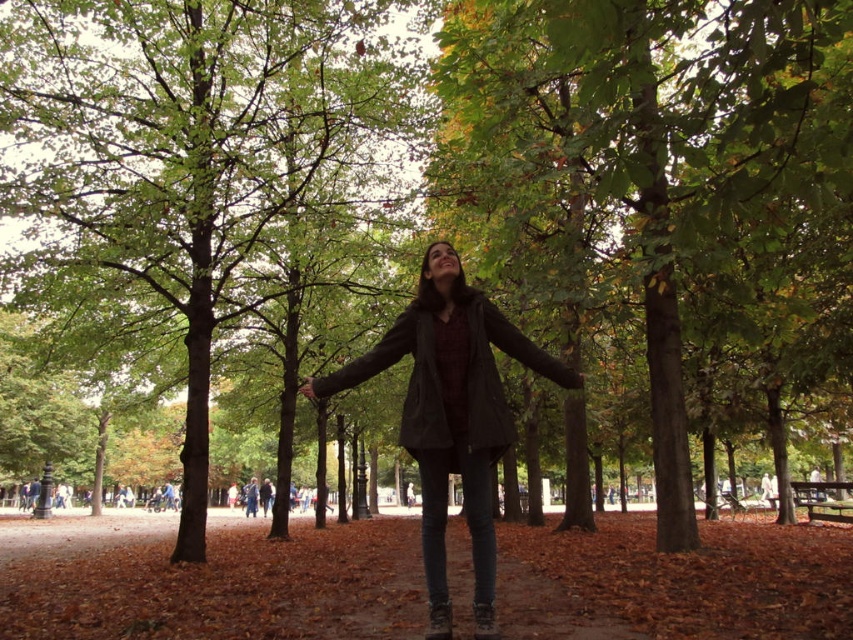
Does green leafy tree at center have a larger size compared to matte black jacket at center?

Actually, green leafy tree at center might be smaller than matte black jacket at center.

Does green leafy tree at center have a greater width compared to matte black jacket at center?

Incorrect, green leafy tree at center's width does not surpass matte black jacket at center's.

Between point (190, 477) and point (439, 378), which one is positioned behind?

The point (190, 477) is behind.

Image resolution: width=853 pixels, height=640 pixels. Find the location of `green leafy tree at center`. green leafy tree at center is located at coordinates (183, 148).

Between matte black jacket at center and dark gray matte jacket at center, which one appears on the left side from the viewer's perspective?

matte black jacket at center

Is point (490, 390) more distant than point (383, 337)?

No, (490, 390) is closer to viewer.

Image resolution: width=853 pixels, height=640 pixels. Find the location of `matte black jacket at center`. matte black jacket at center is located at coordinates (x=451, y=416).

Is point (519, 166) behind point (488, 596)?

Yes, point (519, 166) is farther from viewer.

Does green matte tree at center have a lesser width compared to matte black jacket at center?

No, green matte tree at center is not thinner than matte black jacket at center.

Measure the distance between point [590,3] and camera.

Point [590,3] is 2.94 meters away from camera.

Locate an element on the screen. green matte tree at center is located at coordinates (666, 170).